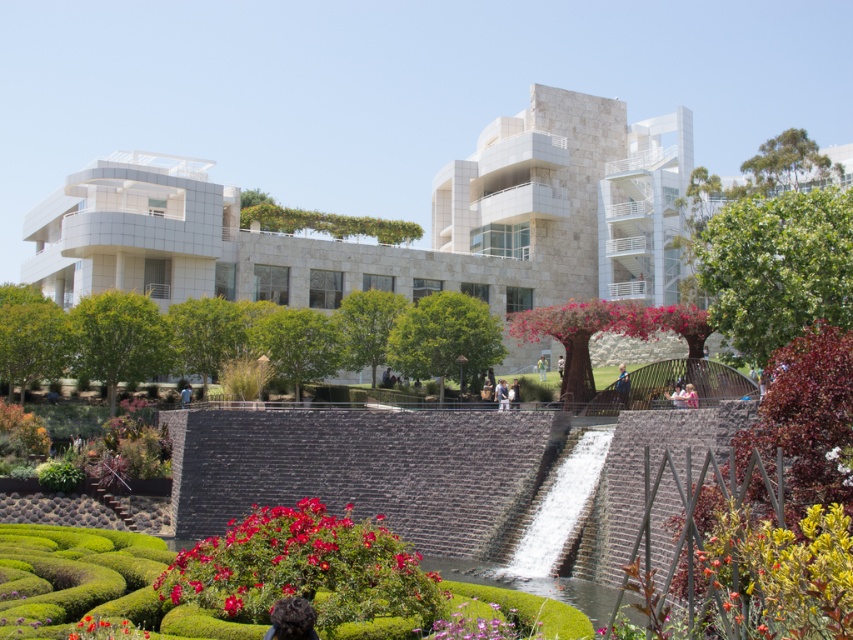
You are standing at the entrance of the museum and want to take a photo of the green leafy hedge at right. If your camera has a maximum focus range of 50 meters, will it be able to capture the hedge clearly?

The green leafy hedge at right is 48.81 meters away from the camera. Since the maximum focus range is 50 meters, the camera can capture the hedge clearly as the distance is within the range.